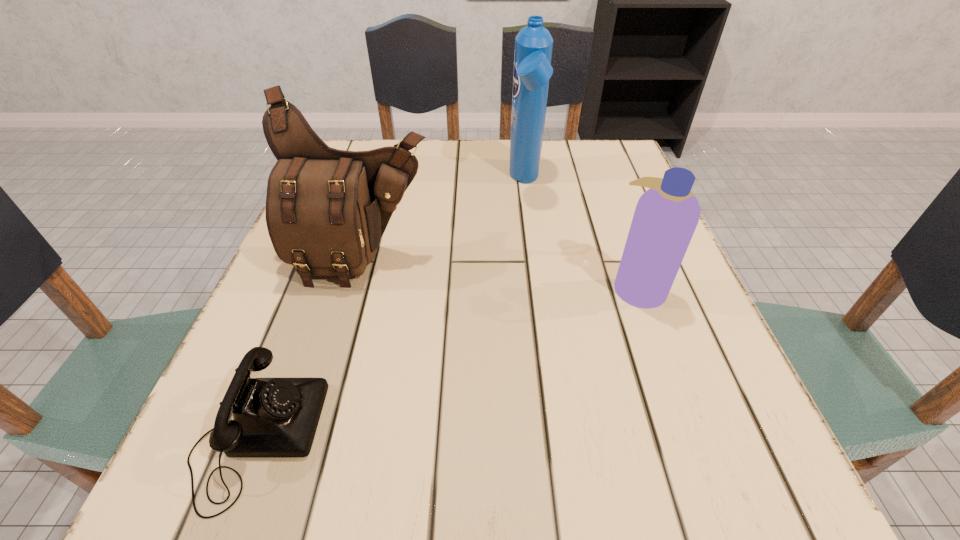
This screenshot has height=540, width=960. I want to click on free region at the right edge of the desktop, so click(x=666, y=329).

Find the location of a particular element. The width and height of the screenshot is (960, 540). vacant space at the far left corner is located at coordinates (357, 144).

The image size is (960, 540). I want to click on free spot at the far right corner of the desktop, so click(x=624, y=181).

Image resolution: width=960 pixels, height=540 pixels. I want to click on free area in between the nearest object and the second shortest object, so click(x=446, y=362).

In order to click on vacant point located between the telephone and the right shampoo in this screenshot , I will do `click(446, 362)`.

You are a GUI agent. You are given a task and a screenshot of the screen. Output one action in this format:
    pyautogui.click(x=<x>, y=<y>)
    Task: Click on the vacant space in between the shorter shampoo and the shoulder bag
    This screenshot has height=540, width=960.
    Given the screenshot: What is the action you would take?
    pyautogui.click(x=500, y=273)

Identify the location of free space between the telephone and the shoulder bag. This screenshot has width=960, height=540. (310, 347).

Locate an element on the screen. The width and height of the screenshot is (960, 540). free space between the nearest object and the farther shampoo is located at coordinates (391, 309).

The width and height of the screenshot is (960, 540). Identify the location of free spot between the telephone and the farthest object. (391, 309).

Find the location of a particular element. unoccupied area between the shortest object and the shoulder bag is located at coordinates pyautogui.click(x=310, y=347).